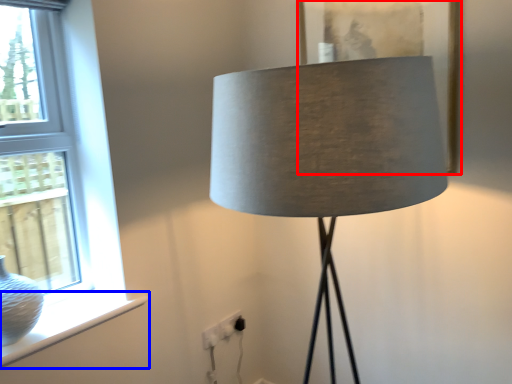
Question: Which object appears closest to the camera in this image, picture frame (highlighted by a red box) or window sill (highlighted by a blue box)?

Choices:
 (A) picture frame
 (B) window sill

Answer: (B)